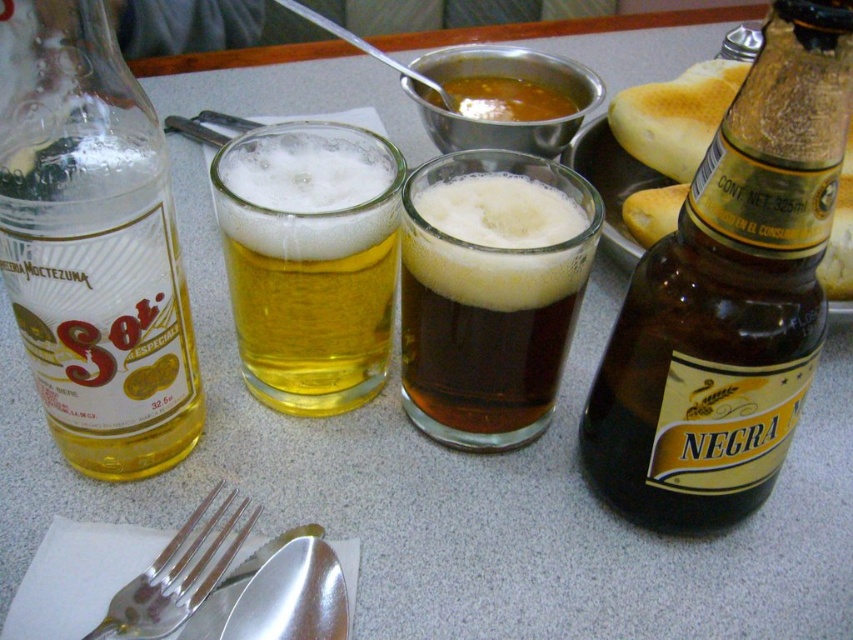
Question: Which point is closer to the camera?

Choices:
 (A) silver metallic spoon at lower center
 (B) brown matte glass at center
 (C) clear glass bottle at left

Answer: (C)

Question: Which of the following is the farthest from the observer?

Choices:
 (A) (699, 216)
 (B) (216, 572)
 (C) (521, 400)

Answer: (C)

Question: Is brown glass bottle at upper right wider than brown matte soup at center?

Choices:
 (A) yes
 (B) no

Answer: (B)

Question: Can you confirm if brown matte glass at center is bigger than silver metallic spoon at lower center?

Choices:
 (A) no
 (B) yes

Answer: (B)

Question: Which point is closer to the camera taking this photo?

Choices:
 (A) (316, 152)
 (B) (407, 218)
 (C) (711, 404)
 (D) (444, 104)

Answer: (C)

Question: In this image, where is clear glass bottle at left located relative to golden glass beer at center?

Choices:
 (A) left
 (B) right

Answer: (A)